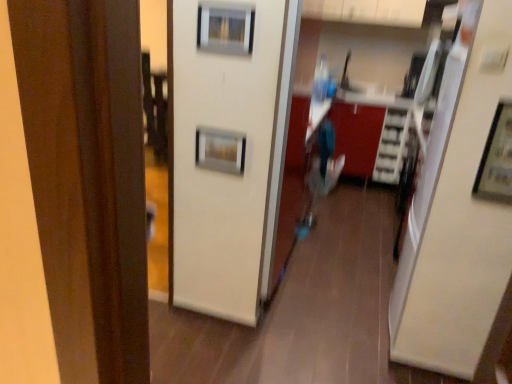
Question: Is metallic silver picture frame at upper right, positioned as the third picture frame in top-to-bottom order, to the right of metallic silver picture frame at upper center, the second picture frame in the left-to-right sequence, from the viewer's perspective?

Choices:
 (A) no
 (B) yes

Answer: (B)

Question: Is metallic silver picture frame at upper right, the third picture frame positioned from the back, smaller than metallic silver picture frame at upper center, placed as the second picture frame when sorted from back to front?

Choices:
 (A) yes
 (B) no

Answer: (B)

Question: Is metallic silver picture frame at upper right, which is the 3th picture frame in left-to-right order, next to metallic silver picture frame at upper center, the 3th picture frame in the bottom-to-top sequence, and touching it?

Choices:
 (A) no
 (B) yes

Answer: (A)

Question: Is metallic silver picture frame at upper right, which is the 3th picture frame in left-to-right order, further to camera compared to metallic silver picture frame at upper center, the 3th picture frame in the bottom-to-top sequence?

Choices:
 (A) no
 (B) yes

Answer: (A)

Question: Can metallic silver picture frame at upper center, placed as the second picture frame when sorted from back to front, be found inside metallic silver picture frame at upper right, which is the first picture frame from bottom to top?

Choices:
 (A) yes
 (B) no

Answer: (B)

Question: From a real-world perspective, is metallic silver picture frame at center, the third picture frame viewed from the right, physically located above or below metallic silver picture frame at upper right, positioned as the third picture frame in top-to-bottom order?

Choices:
 (A) above
 (B) below

Answer: (B)

Question: In terms of width, does metallic silver picture frame at center, the third picture frame viewed from the right, look wider or thinner when compared to metallic silver picture frame at upper right, the 1th picture frame in the right-to-left sequence?

Choices:
 (A) thin
 (B) wide

Answer: (A)

Question: Choose the correct answer: Is metallic silver picture frame at center, the 1th picture frame when ordered from left to right, inside metallic silver picture frame at upper right, which is the first picture frame from bottom to top, or outside it?

Choices:
 (A) outside
 (B) inside

Answer: (A)

Question: From the image's perspective, relative to metallic silver picture frame at upper right, the 1th picture frame in the right-to-left sequence, is metallic silver picture frame at center, the 2th picture frame in the top-to-bottom sequence, above or below?

Choices:
 (A) above
 (B) below

Answer: (A)

Question: Considering their positions, is metallic silver picture frame at upper right, which is the 3th picture frame in left-to-right order, located in front of or behind white glossy cabinet at upper center?

Choices:
 (A) front
 (B) behind

Answer: (A)

Question: Considering the relative positions of metallic silver picture frame at upper right, the 1th picture frame in the right-to-left sequence, and white glossy cabinet at upper center in the image provided, is metallic silver picture frame at upper right, the 1th picture frame in the right-to-left sequence, to the left or to the right of white glossy cabinet at upper center?

Choices:
 (A) left
 (B) right

Answer: (A)

Question: Is metallic silver picture frame at upper right, the first picture frame in the front-to-back sequence, taller or shorter than white glossy cabinet at upper center?

Choices:
 (A) short
 (B) tall

Answer: (B)

Question: From a real-world perspective, is metallic silver picture frame at upper right, the first picture frame in the front-to-back sequence, positioned above or below white glossy cabinet at upper center?

Choices:
 (A) above
 (B) below

Answer: (B)

Question: Considering the positions of white glossy cabinet at upper center and metallic silver picture frame at center, the third picture frame viewed from the right, in the image, is white glossy cabinet at upper center taller or shorter than metallic silver picture frame at center, the third picture frame viewed from the right,?

Choices:
 (A) tall
 (B) short

Answer: (A)

Question: Is point (421, 1) closer or farther from the camera than point (202, 139)?

Choices:
 (A) closer
 (B) farther

Answer: (B)